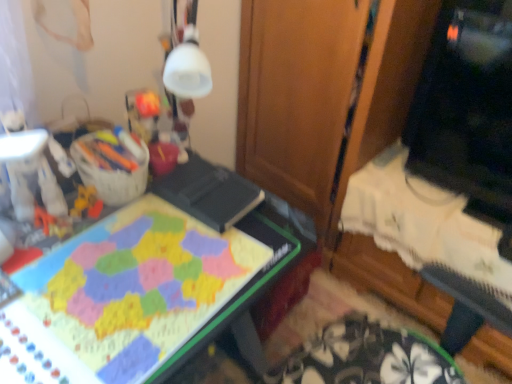
Measure the distance between point (477, 117) and camera.

The distance of point (477, 117) from camera is 1.42 meters.

This screenshot has width=512, height=384. I want to click on black glossy monitor at upper right, so click(467, 108).

In terms of height, does matte plastic board game at center look taller or shorter compared to black glossy monitor at upper right?

Clearly, matte plastic board game at center is taller compared to black glossy monitor at upper right.

Is matte plastic board game at center inside or outside of black glossy monitor at upper right?

matte plastic board game at center lies outside black glossy monitor at upper right.

Locate an element on the screen. Image resolution: width=512 pixels, height=384 pixels. computer monitor above the matte plastic board game at center (from a real-world perspective) is located at coordinates (467, 108).

Is matte plastic board game at center wider than black glossy monitor at upper right?

Yes, matte plastic board game at center is wider than black glossy monitor at upper right.

Choose the correct answer: Is wooden at center inside matte plastic board game at center or outside it?

wooden at center is located beyond the bounds of matte plastic board game at center.

From the image's perspective, is wooden at center beneath matte plastic board game at center?

No, from the image's perspective, wooden at center is not beneath matte plastic board game at center.

Considering the sizes of objects wooden at center and matte plastic board game at center in the image provided, who is wider, wooden at center or matte plastic board game at center?

Wider between the two is wooden at center.

Considering the relative positions of wooden at center and matte plastic board game at center in the image provided, is wooden at center to the left or to the right of matte plastic board game at center?

wooden at center is positioned on matte plastic board game at center's right side.

Is matte plastic board game at center positioned in front of wooden at center?

Yes, it is.

Is point (129, 276) behind point (374, 136)?

No, (129, 276) is closer to viewer.

Would you say matte plastic board game at center is outside wooden at center?

Yes, matte plastic board game at center is located beyond the bounds of wooden at center.

In the scene shown: From a real-world perspective, which object rests below the other?

matte plastic board game at center is physically lower.

Could you tell me if black glossy monitor at upper right is facing plush yellow toy at left?

No, black glossy monitor at upper right is not facing towards plush yellow toy at left.

Between black glossy monitor at upper right and plush yellow toy at left, which one appears on the right side from the viewer's perspective?

Positioned to the right is black glossy monitor at upper right.

In the image, is black glossy monitor at upper right positioned in front of or behind plush yellow toy at left?

Visually, black glossy monitor at upper right is located behind plush yellow toy at left.

From a real-world perspective, is black glossy monitor at upper right positioned under plush yellow toy at left based on gravity?

No.

Which point is more forward, (443,144) or (237,148)?

The point (443,144) is more forward.

How much distance is there between black glossy monitor at upper right and wooden at center?

The distance of black glossy monitor at upper right from wooden at center is 14.27 inches.

Considering the relative positions of black glossy monitor at upper right and wooden at center in the image provided, is black glossy monitor at upper right to the left of wooden at center from the viewer's perspective?

No, black glossy monitor at upper right is not to the left of wooden at center.

How many degrees apart are the facing directions of black glossy monitor at upper right and wooden at center?

1.23 degrees separate the facing orientations of black glossy monitor at upper right and wooden at center.

Would you say matte plastic board game at center contains plush yellow toy at left?

Yes, plush yellow toy at left can be found within matte plastic board game at center.

Which of these two, matte plastic board game at center or plush yellow toy at left, is bigger?

With larger size is matte plastic board game at center.

This screenshot has width=512, height=384. Find the location of `toy above the matte plastic board game at center (from the image's perspective)`. toy above the matte plastic board game at center (from the image's perspective) is located at coordinates (87, 202).

Considering the sizes of objects matte plastic board game at center and plush yellow toy at left in the image provided, who is shorter, matte plastic board game at center or plush yellow toy at left?

plush yellow toy at left.

How different are the orientations of wooden at center and plush yellow toy at left in degrees?

The angular difference between wooden at center and plush yellow toy at left is 94.1 degrees.

Based on the photo, between wooden at center and plush yellow toy at left, which one has more height?

With more height is wooden at center.

Is wooden at center completely or partially outside of plush yellow toy at left?

Yes, wooden at center is not within plush yellow toy at left.

From the image's perspective, does wooden at center appear lower than plush yellow toy at left?

Actually, wooden at center appears above plush yellow toy at left in the image.

Where is `computer monitor lying above the matte plastic board game at center (from the image's perspective)`? This screenshot has width=512, height=384. computer monitor lying above the matte plastic board game at center (from the image's perspective) is located at coordinates (467, 108).

At what (x,y) coordinates should I click in order to perform the action: click on desk located below the wooden at center (from the image's perspective). Please return your answer as a coordinate pair (x, y). This screenshot has width=512, height=384. Looking at the image, I should click on (x=140, y=291).

Which object lies nearer to the anchor point wooden at center, matte plastic board game at center or plush yellow toy at left?

matte plastic board game at center.

Looking at the image, which one is located closer to plush yellow toy at left, wooden at center or black glossy monitor at upper right?

The object closer to plush yellow toy at left is wooden at center.

Based on their spatial positions, is black glossy monitor at upper right or matte plastic board game at center further from wooden at center?

matte plastic board game at center is further to wooden at center.

In the scene shown: Considering their positions, is plush yellow toy at left positioned closer to black glossy monitor at upper right than wooden at center?

Among the two, wooden at center is located nearer to black glossy monitor at upper right.

From the image, which object appears to be nearer to black glossy monitor at upper right, wooden at center or matte plastic board game at center?

wooden at center lies closer to black glossy monitor at upper right than the other object.

Considering their positions, is matte plastic board game at center positioned further to plush yellow toy at left than black glossy monitor at upper right?

The object further to plush yellow toy at left is black glossy monitor at upper right.

When comparing their distances from matte plastic board game at center, does plush yellow toy at left or wooden at center seem closer?

Based on the image, plush yellow toy at left appears to be nearer to matte plastic board game at center.

When comparing their distances from black glossy monitor at upper right, does wooden at center or plush yellow toy at left seem further?

plush yellow toy at left is positioned further to the anchor black glossy monitor at upper right.

Find the location of a particular element. The image size is (512, 384). dresser situated between matte plastic board game at center and black glossy monitor at upper right from left to right is located at coordinates (324, 93).

Identify the location of desk between plush yellow toy at left and wooden at center in the horizontal direction. (140, 291).

Locate an element on the screen. The width and height of the screenshot is (512, 384). desk located between plush yellow toy at left and black glossy monitor at upper right in the left-right direction is located at coordinates (140, 291).

This screenshot has width=512, height=384. I want to click on dresser between plush yellow toy at left and black glossy monitor at upper right in the horizontal direction, so click(324, 93).